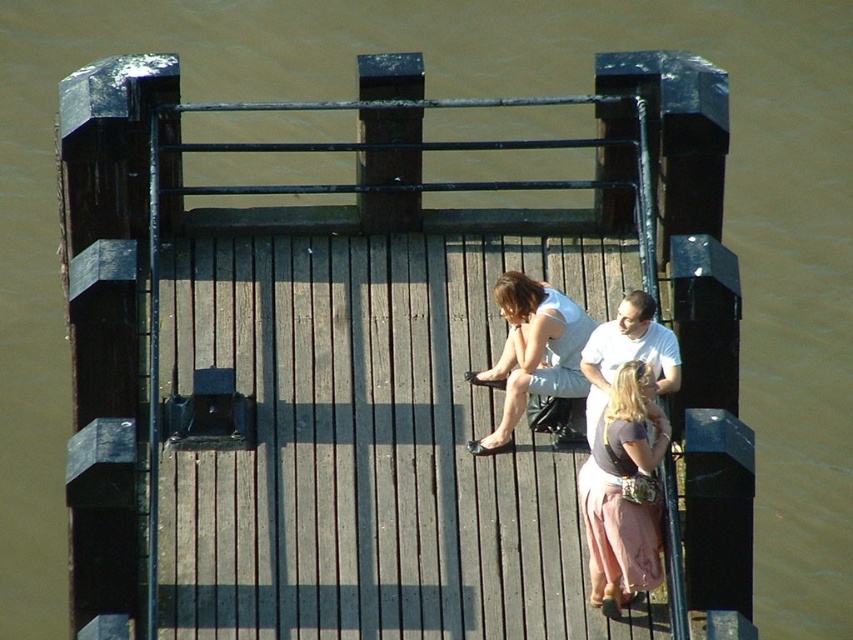
Which is behind, point (637, 442) or point (576, 356)?

Point (576, 356)

Is matte pink skirt at center shorter than matte white tank top at center?

Incorrect, matte pink skirt at center's height does not fall short of matte white tank top at center's.

Is point (595, 538) in front of point (583, 380)?

Yes, it is.

Find the location of a particular element. matte pink skirt at center is located at coordinates (622, 492).

Is matte white tank top at center thinner than white cotton shirt at center?

No.

Is point (508, 392) farther from viewer compared to point (668, 385)?

Yes, it is.

This screenshot has width=853, height=640. In order to click on matte white tank top at center in this screenshot , I will do point(532,353).

Can you confirm if matte pink skirt at center is wider than white cotton shirt at center?

In fact, matte pink skirt at center might be narrower than white cotton shirt at center.

Who is positioned more to the right, matte pink skirt at center or white cotton shirt at center?

white cotton shirt at center is more to the right.

Is point (653, 422) more distant than point (677, 358)?

No.

You are a GUI agent. You are given a task and a screenshot of the screen. Output one action in this format:
    pyautogui.click(x=<x>, y=<y>)
    Task: Click on the matte pink skirt at center
    
    Given the screenshot: What is the action you would take?
    pyautogui.click(x=622, y=492)